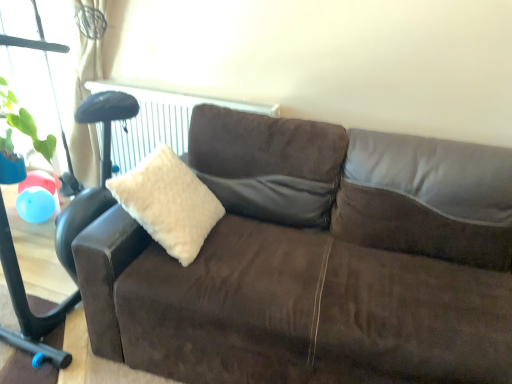
The height and width of the screenshot is (384, 512). What do you see at coordinates (317, 267) in the screenshot?
I see `brown suede couch at center` at bounding box center [317, 267].

Find the location of a particular element. This screenshot has width=512, height=384. brown suede couch at center is located at coordinates [x=317, y=267].

You are a GUI agent. You are given a task and a screenshot of the screen. Output one action in this format:
    pyautogui.click(x=<x>, y=<y>)
    Task: Click on the white fluffy pillow at center
    
    Given the screenshot: What is the action you would take?
    pyautogui.click(x=168, y=203)

What is the approximate width of white fluffy pillow at center?

white fluffy pillow at center is 40.02 centimeters in width.

What do you see at coordinates (168, 203) in the screenshot?
I see `white fluffy pillow at center` at bounding box center [168, 203].

The image size is (512, 384). I want to click on brown suede couch at center, so click(x=317, y=267).

Does white fluffy pillow at center appear on the left side of brown suede couch at center?

Yes, white fluffy pillow at center is to the left of brown suede couch at center.

Is white fluffy pillow at center in front of brown suede couch at center?

No, the depth of white fluffy pillow at center is greater than that of brown suede couch at center.

Does point (162, 216) come in front of point (239, 370)?

No, it is behind (239, 370).

From the image's perspective, relative to brown suede couch at center, is white fluffy pillow at center above or below?

Based on their image positions, white fluffy pillow at center is located above brown suede couch at center.

From a real-world perspective, is white fluffy pillow at center physically above brown suede couch at center?

Yes, from a real-world perspective, white fluffy pillow at center is on top of brown suede couch at center.

Which object is thinner, white fluffy pillow at center or brown suede couch at center?

With smaller width is white fluffy pillow at center.

Which of these two, white fluffy pillow at center or brown suede couch at center, stands taller?

brown suede couch at center.

Considering the sizes of objects white fluffy pillow at center and brown suede couch at center in the image provided, who is smaller, white fluffy pillow at center or brown suede couch at center?

white fluffy pillow at center.

Is brown suede couch at center a part of white fluffy pillow at center?

No, white fluffy pillow at center does not contain brown suede couch at center.

Are white fluffy pillow at center and brown suede couch at center far apart?

No, white fluffy pillow at center is in close proximity to brown suede couch at center.

Is white fluffy pillow at center oriented away from brown suede couch at center?

Yes, white fluffy pillow at center is positioned with its back facing brown suede couch at center.

Identify the location of studio couch below the white fluffy pillow at center (from the image's perspective). The height and width of the screenshot is (384, 512). (317, 267).

Which object is positioned more to the left, brown suede couch at center or white fluffy pillow at center?

Positioned to the left is white fluffy pillow at center.

Is brown suede couch at center further to the viewer compared to white fluffy pillow at center?

No, brown suede couch at center is closer to the viewer.

Which is in front, point (222, 108) or point (213, 194)?

The point (222, 108) is closer to the camera.

From the image's perspective, would you say brown suede couch at center is shown under white fluffy pillow at center?

Indeed, from the image's perspective, brown suede couch at center is shown beneath white fluffy pillow at center.

Looking at this image, from a real-world perspective, who is located lower, brown suede couch at center or white fluffy pillow at center?

brown suede couch at center, from a real-world perspective.

Which of these two, brown suede couch at center or white fluffy pillow at center, is thinner?

white fluffy pillow at center is thinner.

Based on the photo, between brown suede couch at center and white fluffy pillow at center, which one has more height?

With more height is brown suede couch at center.

Is brown suede couch at center smaller than white fluffy pillow at center?

Actually, brown suede couch at center might be larger than white fluffy pillow at center.

Is brown suede couch at center outside of white fluffy pillow at center?

Yes, brown suede couch at center is not within white fluffy pillow at center.

Is brown suede couch at center with white fluffy pillow at center?

No, brown suede couch at center is not making contact with white fluffy pillow at center.

Could you tell me if brown suede couch at center is turned towards white fluffy pillow at center?

Yes, brown suede couch at center faces towards white fluffy pillow at center.

Image resolution: width=512 pixels, height=384 pixels. What are the coordinates of `studio couch beneath the white fluffy pillow at center (from a real-world perspective)` in the screenshot? It's located at (317, 267).

I want to click on studio couch located underneath the white fluffy pillow at center (from a real-world perspective), so click(317, 267).

Image resolution: width=512 pixels, height=384 pixels. What are the coordinates of `studio couch lying below the white fluffy pillow at center (from the image's perspective)` in the screenshot? It's located at (317, 267).